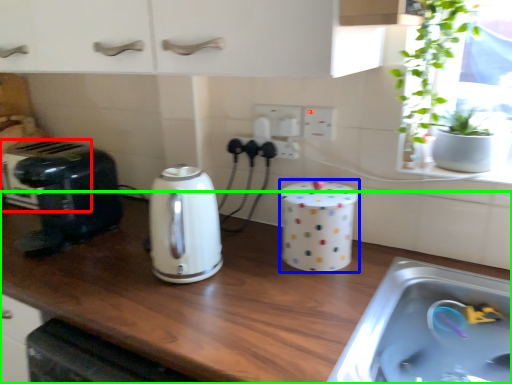
Question: Based on their relative distances, which object is farther from appliance (highlighted by a red box)? Choose from appliance (highlighted by a blue box) and countertop (highlighted by a green box).

Choices:
 (A) appliance
 (B) countertop

Answer: (A)